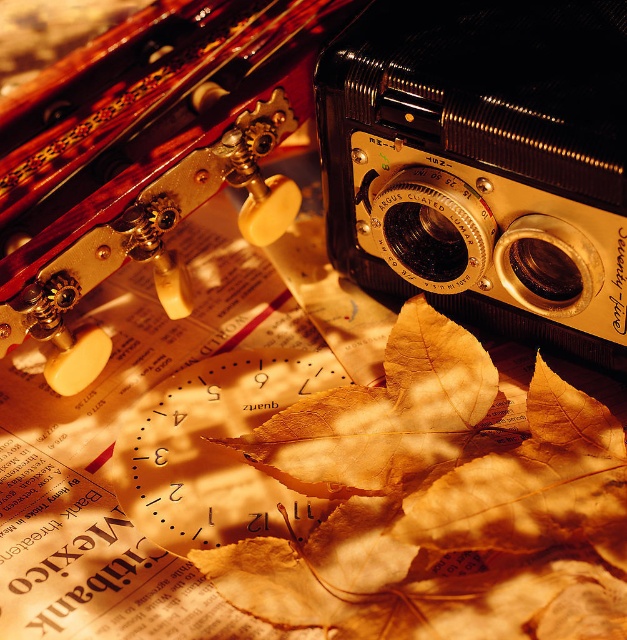
You are an artist setting up a still life scene with the gold metallic camera at center and the golden dried leaf at center. According to the arrangement, which object is positioned to the left of the other?

The golden dried leaf at center is to the left of the gold metallic camera at center.

You are an archaeologist who needs to locate the exact coordinates of the gold metallic camera at center in the image. What are its coordinates?

The coordinates of the gold metallic camera at center are at point (483, 163).

You are an artist trying to place a golden dried leaf at center on top of the gold metallic camera at center in the image. Based on their sizes, will the leaf fit entirely on the camera?

The gold metallic camera at center might be wider than golden dried leaf at center, so there is a possibility that the leaf could fit, but it is uncertain without exact measurements.